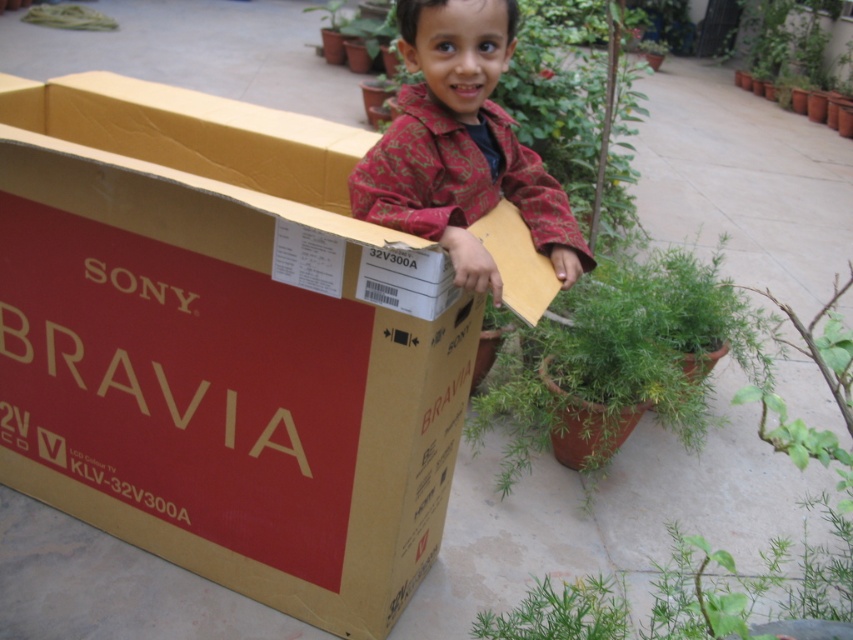
Question: Which point is farther to the camera?

Choices:
 (A) green leafy plant at lower center
 (B) cardboard box at center
 (C) green matte plant at center

Answer: (C)

Question: Does cardboard box at center have a lesser width compared to green leafy plant at upper right?

Choices:
 (A) no
 (B) yes

Answer: (A)

Question: Is the position of red paisley shirt at center less distant than that of green leafy plant at upper right?

Choices:
 (A) yes
 (B) no

Answer: (A)

Question: Is the position of red paisley shirt at center less distant than that of green leafy plant at upper right?

Choices:
 (A) yes
 (B) no

Answer: (A)

Question: Which point appears farthest from the camera in this image?

Choices:
 (A) (471, 252)
 (B) (331, 321)
 (C) (555, 618)
 (D) (689, 408)

Answer: (D)

Question: Which point is farther from the camera taking this photo?

Choices:
 (A) (572, 616)
 (B) (851, 74)
 (C) (717, 252)

Answer: (B)